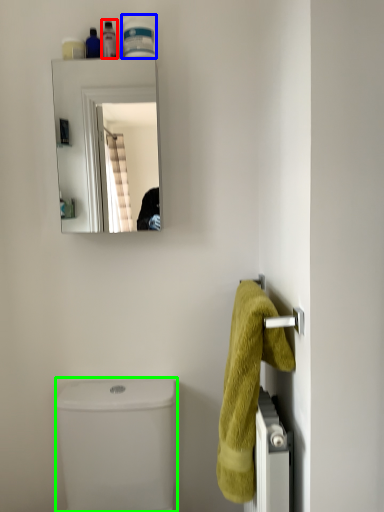
Question: Which object is positioned closest to toiletry (highlighted by a red box)? Select from toiletry (highlighted by a blue box) and toilet bowl (highlighted by a green box).

Choices:
 (A) toiletry
 (B) toilet bowl

Answer: (A)